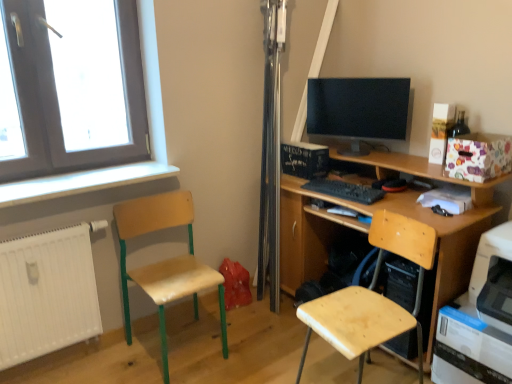
Identify the location of vacant area situated below white matte radiator at lower left (from a real-world perspective). (82, 358).